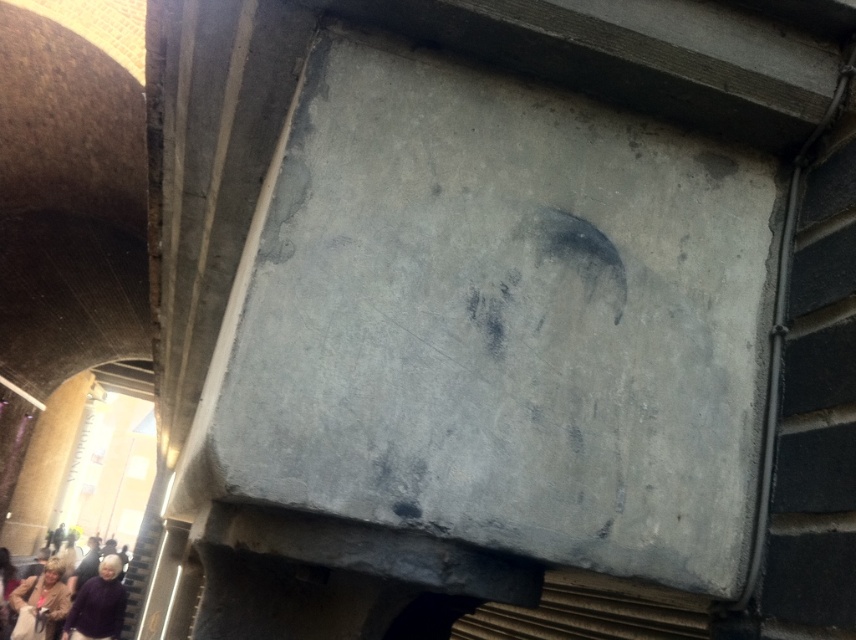
You are standing at the center of the large concrete structure. You see a purple sweater at lower left represented by point (x=98, y=604). If you want to reach the purple sweater at lower left, which direction should you move relative to your current position?

The purple sweater at lower left is located at point (x=98, y=604), which is to the lower left of your current position at the center. Therefore, you should move towards the lower left direction to reach it.

You are an architect inspecting the concrete structure. You notice the smooth gray shutter at right and the purple sweater at lower left. Which object is larger in size?

The purple sweater at lower left is larger than the smooth gray shutter at right.